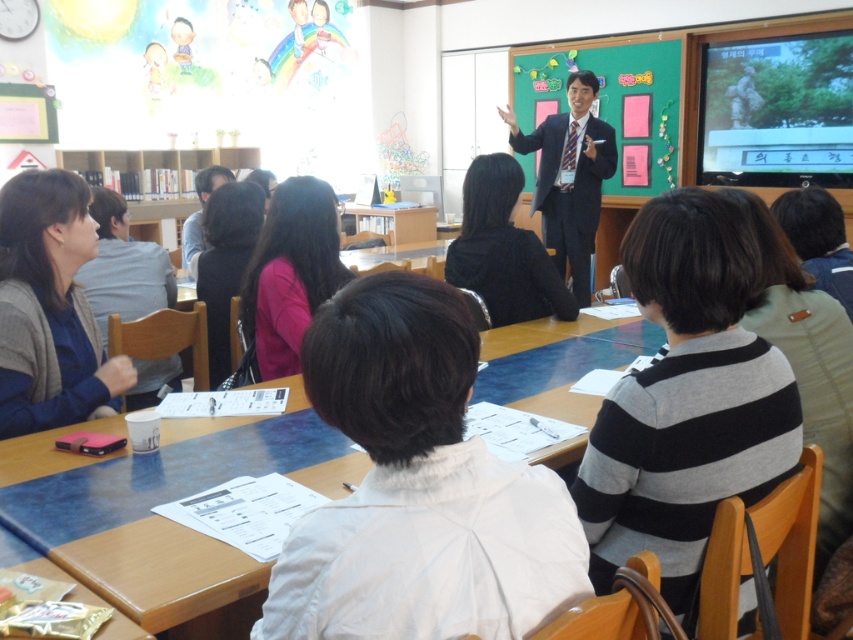
You are an attendee in the classroom and need to write down some notes. Which object, the blue glossy table at center or the green matte chalkboard at center, would be more suitable for placing your notebook?

The blue glossy table at center is more suitable for placing your notebook because it is positioned under the green matte chalkboard at center, making it a flat surface where you can write comfortably.

You are a person standing in the classroom. You need to move from the striped sweater at center to the green matte chalkboard at center. Can you walk directly between them without needing to move any objects?

The striped sweater at center and green matte chalkboard at center are 13.67 feet apart from each other, so yes, you can walk directly between them without needing to move any objects since the distance is sufficient for movement.

You are a participant in the classroom and need to move from your seat to the green matte chalkboard at center. Is the blue glossy table at center in your way?

The blue glossy table at center is to the left of the green matte chalkboard at center, so it might be in your way depending on your path.